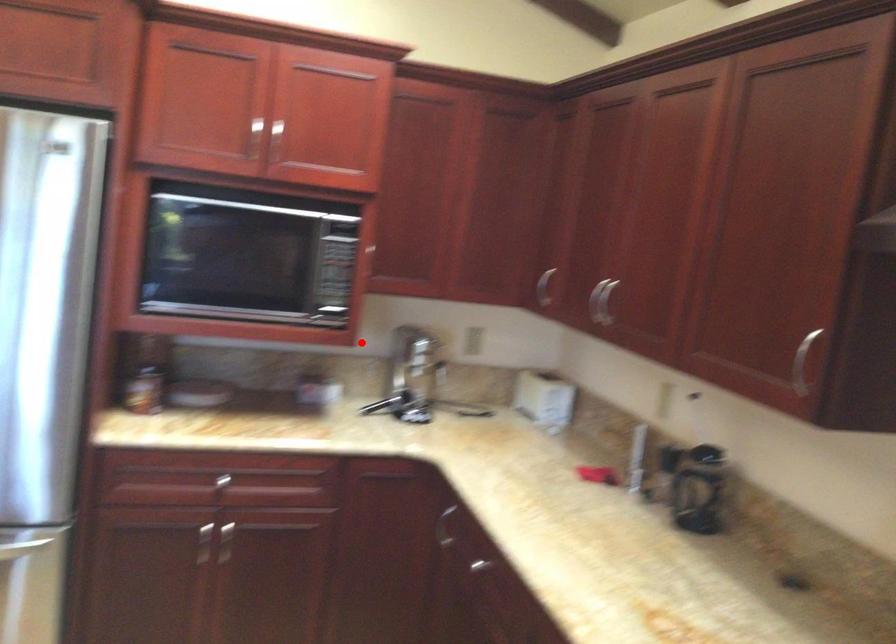
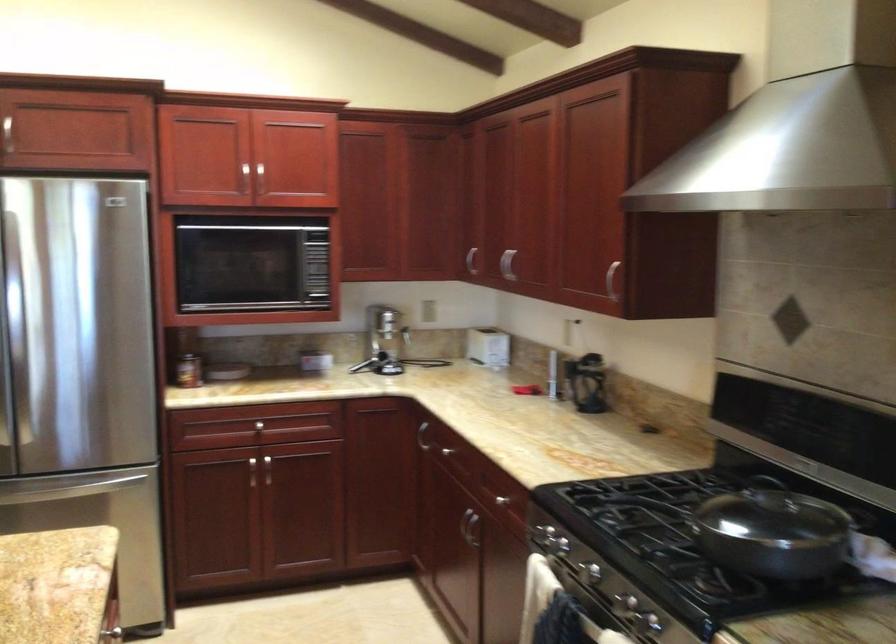
Question: I am providing you with two images of the same scene from different viewpoints. Given a red point in image1, look at the same physical point in image2. Is it:

Choices:
 (A) Closer to the viewpoint
 (B) Farther from the viewpoint

Answer: (B)